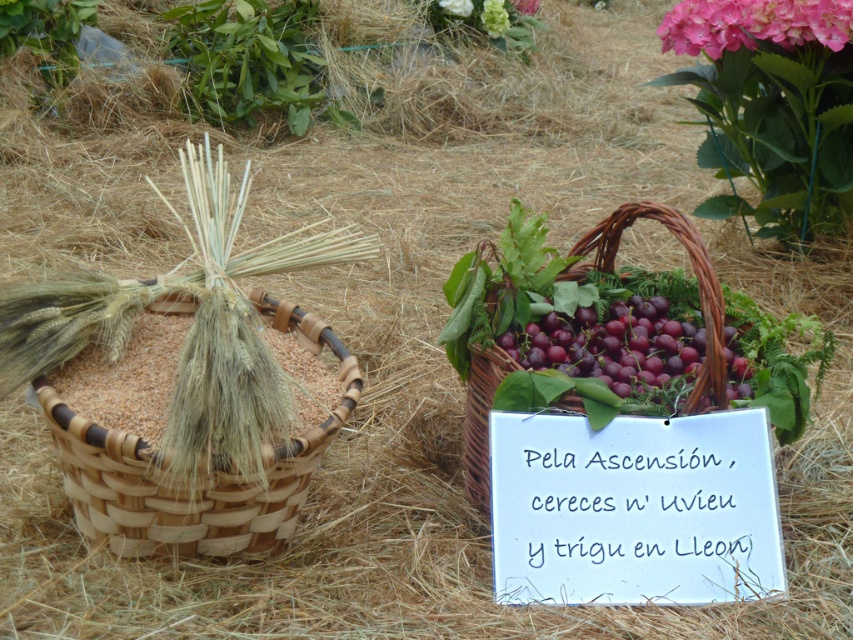
Between point (508, 19) and point (459, 8), which one is positioned in front?

Point (459, 8)

Consider the image. Who is higher up, green leafy plant at upper center or pink matte hydrangea at upper center?

pink matte hydrangea at upper center is above.

I want to click on green leafy plant at upper center, so click(494, 17).

At what (x,y) coordinates should I click in order to perform the action: click on green leafy plant at upper center. Please return your answer as a coordinate pair (x, y). Looking at the image, I should click on (494, 17).

Does pink matte hydrangea at upper center appear over pink fabric flower at upper center?

No.

Does pink matte hydrangea at upper center lie behind pink fabric flower at upper center?

No, pink matte hydrangea at upper center is closer to the viewer.

Image resolution: width=853 pixels, height=640 pixels. In order to click on pink matte hydrangea at upper center in this screenshot , I will do `click(456, 6)`.

Can you confirm if woven brown basket at center is thinner than pink matte hydrangea at upper center?

No.

Which is in front, point (665, 205) or point (437, 3)?

Positioned in front is point (665, 205).

This screenshot has height=640, width=853. What do you see at coordinates (693, 273) in the screenshot? I see `woven brown basket at center` at bounding box center [693, 273].

In order to click on woven brown basket at center in this screenshot , I will do `click(693, 273)`.